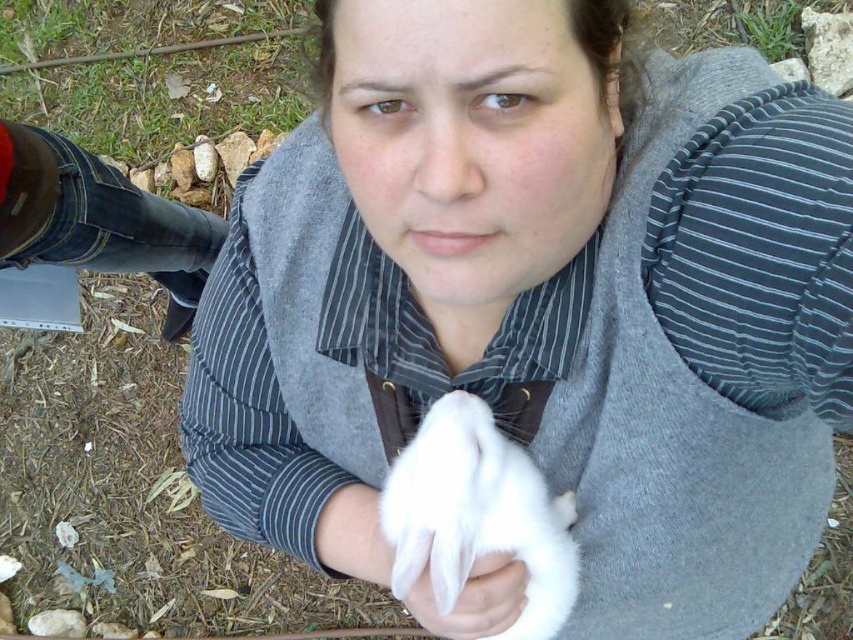
Is white soft fur at center taller than white soft cloth at center?

Yes.

Who is higher up, white soft fur at center or white soft cloth at center?

Positioned higher is white soft fur at center.

This screenshot has height=640, width=853. What are the coordinates of `white soft fur at center` in the screenshot? It's located at (477, 515).

At what (x,y) coordinates should I click in order to perform the action: click on white soft fur at center. Please return your answer as a coordinate pair (x, y). Image resolution: width=853 pixels, height=640 pixels. Looking at the image, I should click on (477, 515).